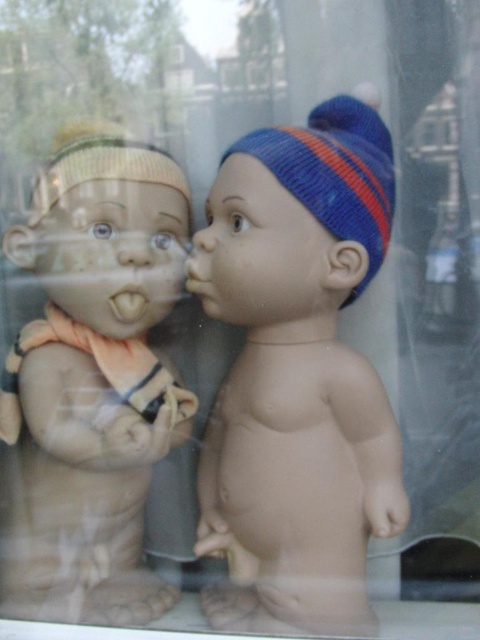
You are a toy collector who wants to display both the matte plastic baby at center and the matte plastic nose at center on a shelf. Since the shelf has limited space, you need to know which one takes up more space. Which object should you place first to maximize space efficiency?

The matte plastic baby at center is bigger than the matte plastic nose at center, so you should place the matte plastic baby at center first to accommodate its larger size, then the matte plastic nose at center can fit into the remaining space.

You are a parent trying to clean up the playroom. You see the matte plastic baby at center and the matte plastic nose at center. Which object is higher up?

The matte plastic nose at center is higher up since it is located above the matte plastic baby at center.